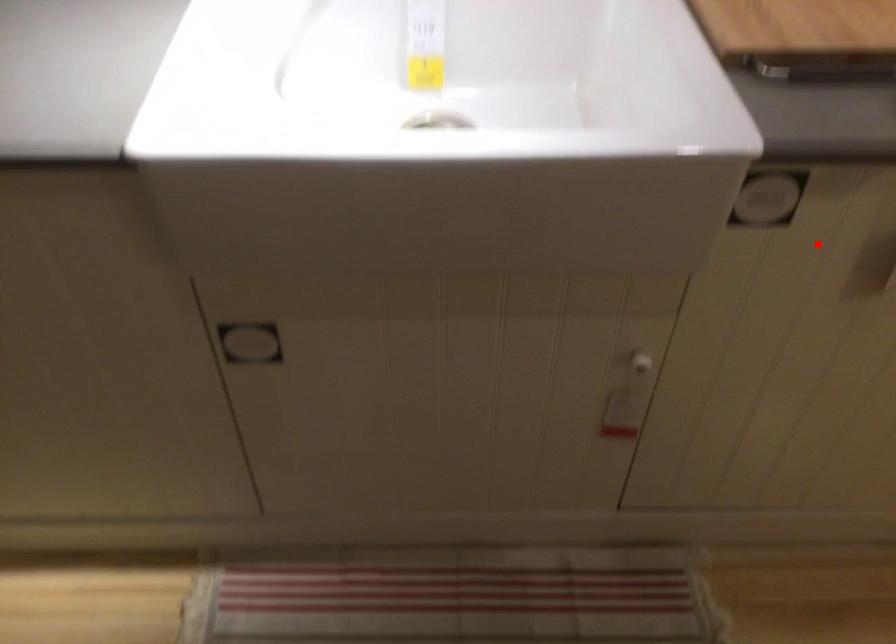
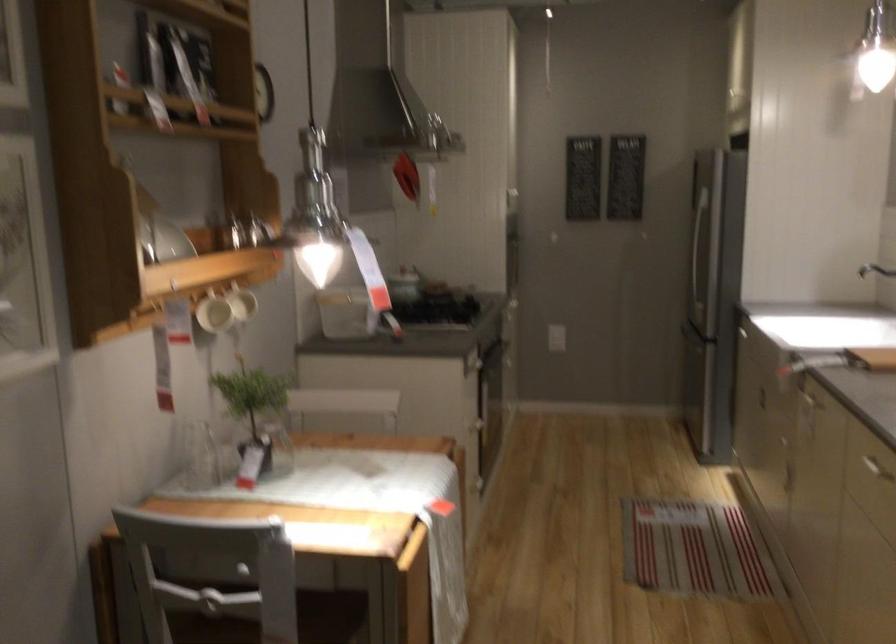
The point at the highlighted location is marked in the first image. Where is the corresponding point in the second image?

(810, 391)